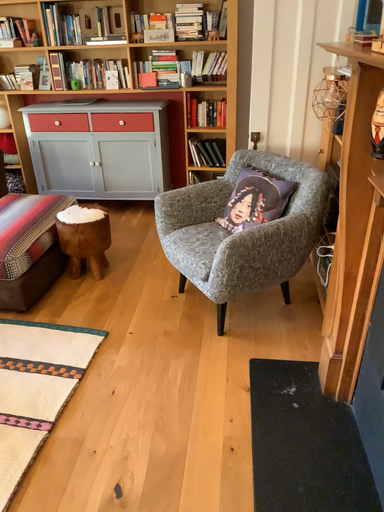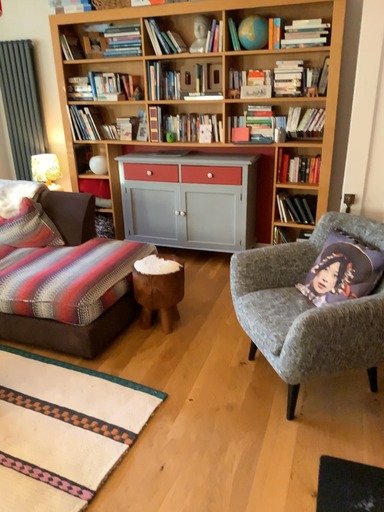
Question: How did the camera likely rotate when shooting the video?

Choices:
 (A) rotated upward
 (B) rotated downward

Answer: (A)